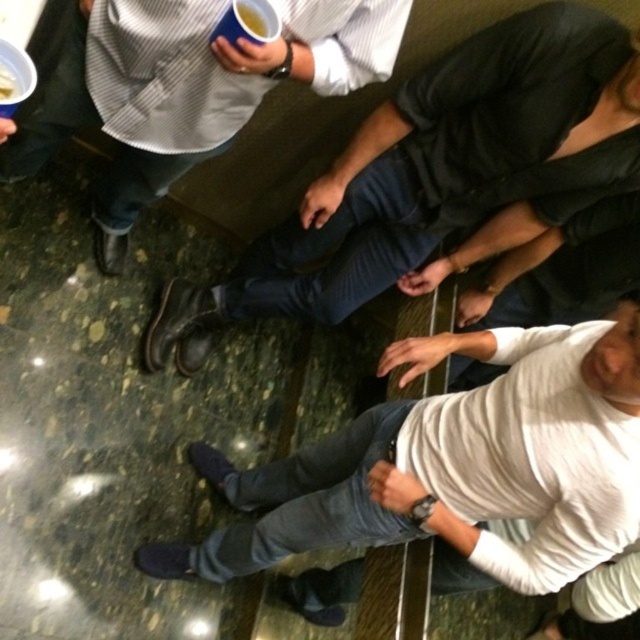
You are a photographer taking a picture of the dark gray jeans at center and the blue paper cup at upper center. Which object will appear larger in your photo?

The dark gray jeans at center will appear larger in the photo because it is bigger than the blue paper cup at upper center.

You are standing at the point labeled as point (406, 490) in the image. You want to greet someone who is 1.2 meters away from you. Is there anyone in the scene within that distance?

The person at point (406, 490) is 1.19 meters away from the viewer, which is within the 1.2 meters distance. So yes, there is someone within that distance.